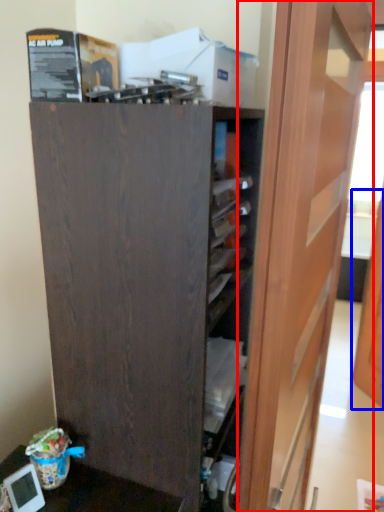
Question: Which object is closer to the camera taking this photo, door (highlighted by a red box) or door (highlighted by a blue box)?

Choices:
 (A) door
 (B) door

Answer: (A)